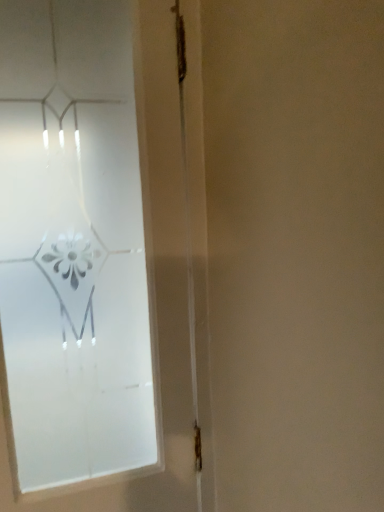
Describe the element at coordinates (73, 245) in the screenshot. The image size is (384, 512). I see `frosted glass window at upper left` at that location.

Image resolution: width=384 pixels, height=512 pixels. I want to click on frosted glass window at upper left, so click(x=73, y=245).

Identify the location of frosted glass window at upper left. (73, 245).